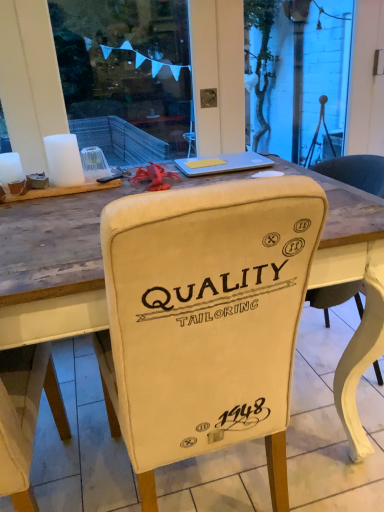
Question: Considering their positions, is beige fabric chair at center located in front of or behind silver metallic laptop at upper center?

Choices:
 (A) behind
 (B) front

Answer: (B)

Question: From the image's perspective, is beige fabric chair at center located above or below silver metallic laptop at upper center?

Choices:
 (A) above
 (B) below

Answer: (B)

Question: Would you say beige fabric chair at center is to the left or to the right of silver metallic laptop at upper center in the picture?

Choices:
 (A) right
 (B) left

Answer: (B)

Question: From the image's perspective, is silver metallic laptop at upper center positioned above or below beige fabric chair at center?

Choices:
 (A) below
 (B) above

Answer: (B)

Question: Relative to beige fabric chair at center, is silver metallic laptop at upper center in front or behind?

Choices:
 (A) behind
 (B) front

Answer: (A)

Question: Choose the correct answer: Is silver metallic laptop at upper center inside beige fabric chair at center or outside it?

Choices:
 (A) outside
 (B) inside

Answer: (A)

Question: Is point (248, 160) positioned closer to the camera than point (198, 227)?

Choices:
 (A) farther
 (B) closer

Answer: (A)